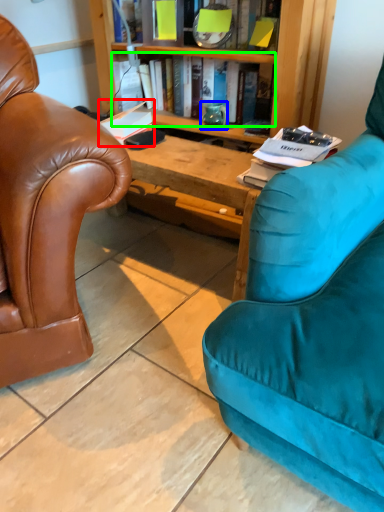
Question: Which object is the closest to the book (highlighted by a red box)? Choose among these: teal (highlighted by a blue box) or book (highlighted by a green box).

Choices:
 (A) teal
 (B) book

Answer: (A)